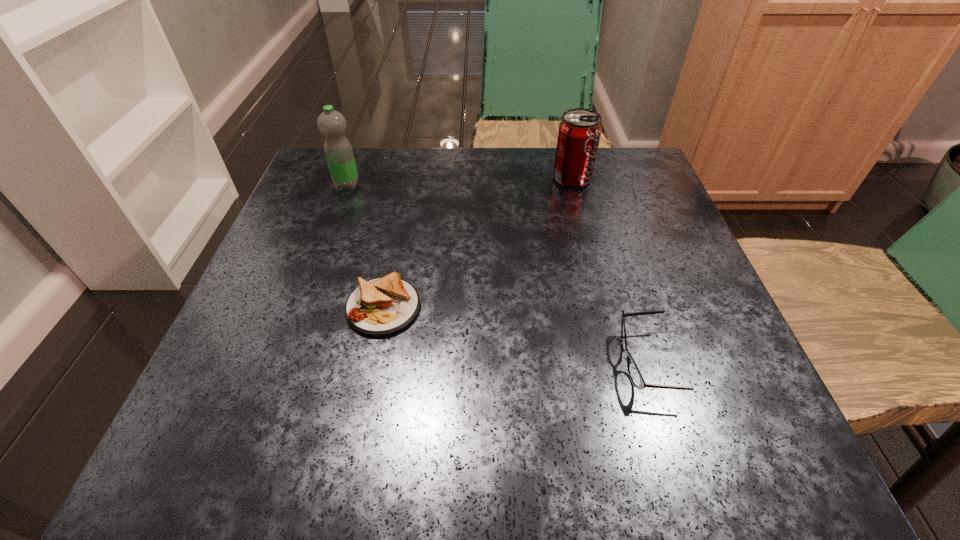
At what (x,y) coordinates should I click in order to perform the action: click on the leftmost object. Please return your answer as a coordinate pair (x, y). The image size is (960, 540). Looking at the image, I should click on [332, 124].

You are a GUI agent. You are given a task and a screenshot of the screen. Output one action in this format:
    pyautogui.click(x=<x>, y=<y>)
    Task: Click on the tallest object
    
    Given the screenshot: What is the action you would take?
    pyautogui.click(x=332, y=124)

Locate an element on the screen. pop soda is located at coordinates (579, 132).

Where is `the third tallest object`? The width and height of the screenshot is (960, 540). the third tallest object is located at coordinates (635, 375).

Find the location of a particular element. sandwich is located at coordinates (382, 306).

Locate an element on the screen. the second object from left to right is located at coordinates (382, 306).

What are the coordinates of `free space located 0.200m on the right of the leftmost object` in the screenshot? It's located at (452, 185).

Where is `vacant space located on the back of the pop soda`? The height and width of the screenshot is (540, 960). vacant space located on the back of the pop soda is located at coordinates (564, 150).

Where is `vacant space positioned on the front-facing side of the spectacles`? vacant space positioned on the front-facing side of the spectacles is located at coordinates (565, 362).

Locate an element on the screen. free space located on the front-facing side of the spectacles is located at coordinates (387, 362).